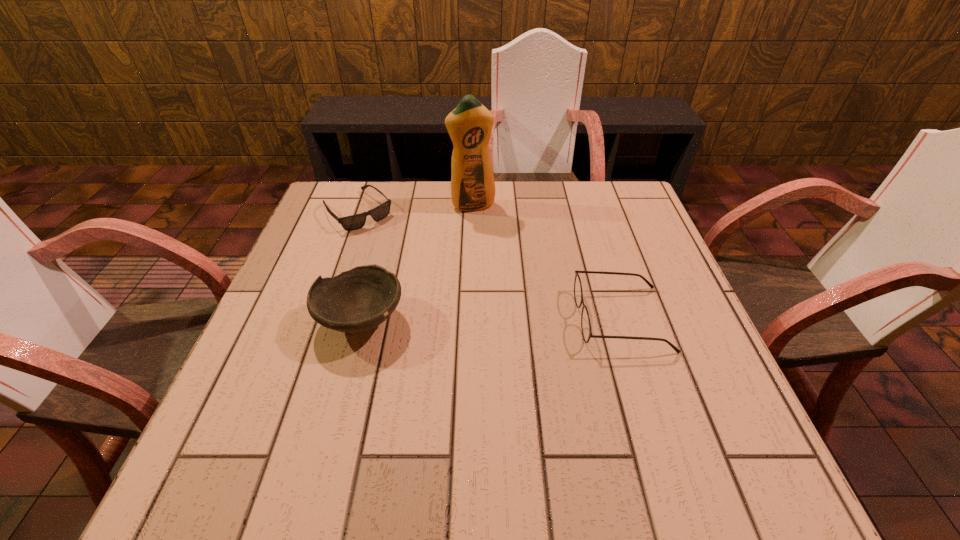
Find the location of a particular element. The image size is (960, 540). free space located on the label of the second object from right to left is located at coordinates (488, 234).

You are a GUI agent. You are given a task and a screenshot of the screen. Output one action in this format:
    pyautogui.click(x=<x>, y=<y>)
    Task: Click on the vacant space located 0.350m on the label of the second object from right to left
    The image size is (960, 540).
    Given the screenshot: What is the action you would take?
    pyautogui.click(x=518, y=300)

Where is `vacant area located 0.100m on the label of the second object from right to left`? This screenshot has height=540, width=960. vacant area located 0.100m on the label of the second object from right to left is located at coordinates (488, 234).

Locate an element on the screen. This screenshot has width=960, height=540. vacant space located on the front-facing side of the shortest object is located at coordinates (407, 264).

Find the location of `vacant region located 0.290m on the front-facing side of the shortest object`. vacant region located 0.290m on the front-facing side of the shortest object is located at coordinates (431, 289).

The width and height of the screenshot is (960, 540). I want to click on vacant space located on the front-facing side of the shortest object, so click(x=401, y=258).

This screenshot has height=540, width=960. I want to click on detergent that is at the far edge, so click(x=469, y=125).

Locate an element on the screen. sunglasses that is at the far edge is located at coordinates (353, 222).

What are the coordinates of `bowl that is positioned at the left edge` in the screenshot? It's located at pyautogui.click(x=355, y=301).

What are the coordinates of `sunglasses that is at the left edge` in the screenshot? It's located at pyautogui.click(x=353, y=222).